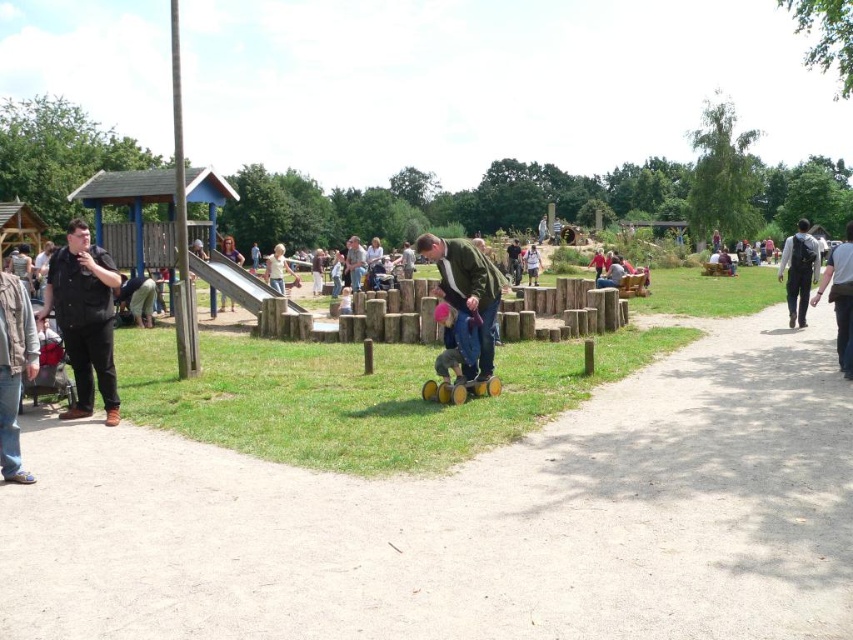
Question: Observing the image, what is the correct spatial positioning of pink fabric at center in reference to denim jacket at center?

Choices:
 (A) right
 (B) left

Answer: (A)

Question: Which point is farther from the camera taking this photo?

Choices:
 (A) (86, 291)
 (B) (125, 278)
 (C) (254, 308)
 (D) (786, 257)

Answer: (B)

Question: Which object appears farthest from the camera in this image?

Choices:
 (A) black matte shirt at left
 (B) faded denim jacket at lower left

Answer: (A)

Question: Does denim jacket at center have a smaller size compared to light blue denim jacket at center?

Choices:
 (A) no
 (B) yes

Answer: (B)

Question: Is light yellow shirt at center below light blue denim jacket at center?

Choices:
 (A) no
 (B) yes

Answer: (A)

Question: Estimate the real-world distances between objects in this image. Which object is closer to the pink fabric at center?

Choices:
 (A) black backpack at right
 (B) light blue fabric at center
 (C) light blue denim jacket at center
 (D) light brown wooden slide at upper left

Answer: (A)